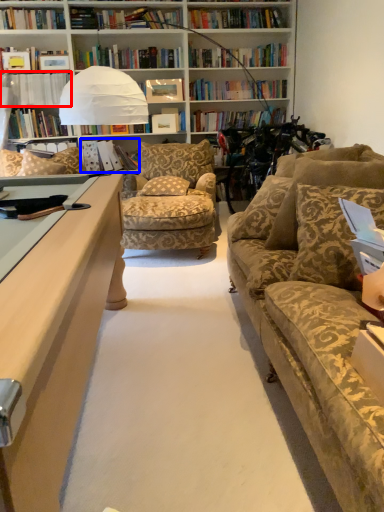
Question: Which object appears closest to the camera in this image, book (highlighted by a red box) or book (highlighted by a blue box)?

Choices:
 (A) book
 (B) book

Answer: (A)